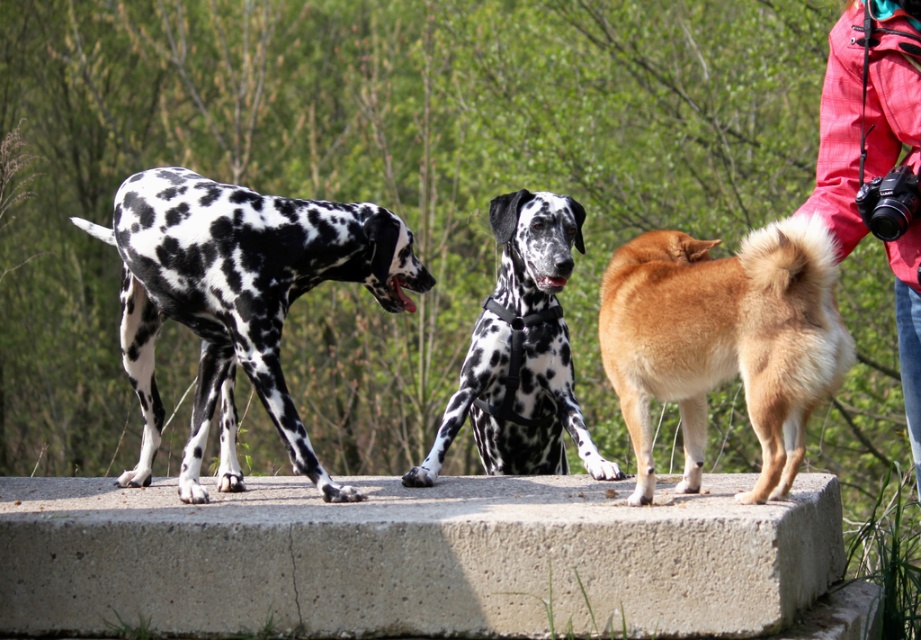
Question: Which object is positioned farthest from the black and white spotted dog at left?

Choices:
 (A) golden fur dog at center
 (B) red plaid jacket at upper right
 (C) spotted fur harness at center
 (D) concreteroughconcrete at center

Answer: (B)

Question: Which of the following is the farthest from the observer?

Choices:
 (A) black and white spotted dog at left
 (B) spotted fur harness at center
 (C) golden fur dog at center
 (D) red plaid jacket at upper right

Answer: (B)

Question: Among these points, which one is farthest from the camera?

Choices:
 (A) (521, 444)
 (B) (226, 401)
 (C) (701, 582)

Answer: (A)

Question: Can you confirm if concreteroughconcrete at center is positioned above spotted fur harness at center?

Choices:
 (A) no
 (B) yes

Answer: (A)

Question: Does black and white spotted dog at left have a larger size compared to spotted fur harness at center?

Choices:
 (A) no
 (B) yes

Answer: (B)

Question: Is concreteroughconcrete at center to the right of red plaid jacket at upper right from the viewer's perspective?

Choices:
 (A) no
 (B) yes

Answer: (A)